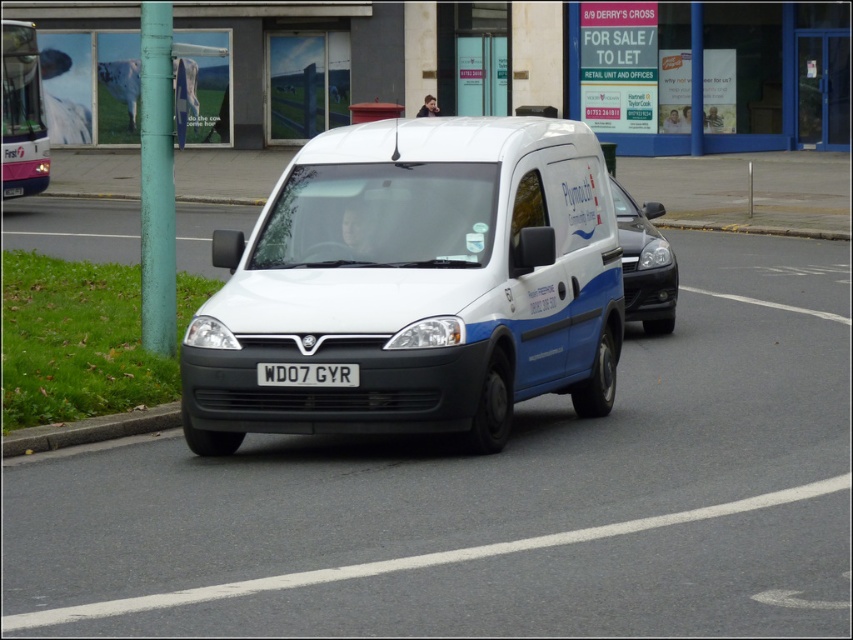
Question: Can you confirm if pink plastic bus at upper left is smaller than glossy black car at center?

Choices:
 (A) yes
 (B) no

Answer: (B)

Question: Considering the real-world distances, which object is farthest from the white metallic license plate at center?

Choices:
 (A) glossy black car at center
 (B) pink plastic bus at upper left
 (C) white matte van at center

Answer: (B)

Question: Does white matte van at center have a smaller size compared to pink plastic bus at upper left?

Choices:
 (A) yes
 (B) no

Answer: (B)

Question: Which point is closer to the camera?

Choices:
 (A) glossy black car at center
 (B) pink plastic bus at upper left

Answer: (A)

Question: Which of the following is the farthest from the observer?

Choices:
 (A) (16, 120)
 (B) (637, 234)
 (C) (283, 378)
 (D) (525, 282)

Answer: (A)

Question: Is pink plastic bus at upper left below white metallic license plate at center?

Choices:
 (A) no
 (B) yes

Answer: (A)